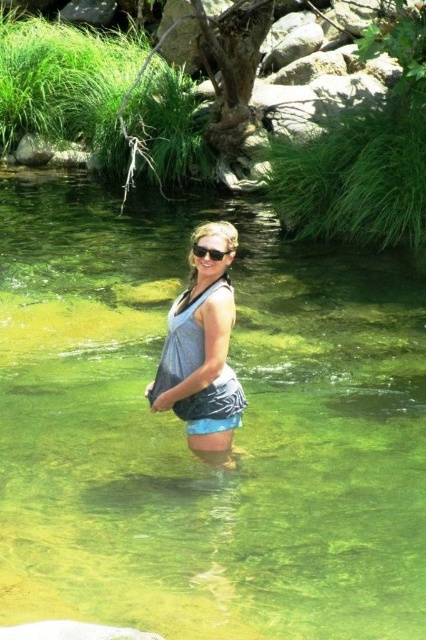
From the picture: Which of these two, gray fabric bikini top at center or black plastic sunglasses at center, stands shorter?

Standing shorter between the two is black plastic sunglasses at center.

Based on the photo, can you confirm if gray fabric bikini top at center is thinner than black plastic sunglasses at center?

No, gray fabric bikini top at center is not thinner than black plastic sunglasses at center.

Find the location of a particular element. Image resolution: width=426 pixels, height=640 pixels. gray fabric bikini top at center is located at coordinates (206, 348).

The height and width of the screenshot is (640, 426). What do you see at coordinates (203, 352) in the screenshot?
I see `gray fabric tank top at center` at bounding box center [203, 352].

Who is taller, gray fabric tank top at center or matte gray bikini top at center?

gray fabric tank top at center

Does point (218, 356) lie in front of point (180, 332)?

That is True.

Identify the location of gray fabric tank top at center. Image resolution: width=426 pixels, height=640 pixels. [x=203, y=352].

Does matte gray bikini top at center have a greater height compared to black plastic sunglasses at center?

Yes, matte gray bikini top at center is taller than black plastic sunglasses at center.

Is point (187, 314) behind point (227, 253)?

Yes.

Measure the distance between matte gray bikini top at center and camera.

matte gray bikini top at center and camera are 4.62 meters apart from each other.

Find the location of a particular element. The image size is (426, 640). matte gray bikini top at center is located at coordinates (192, 307).